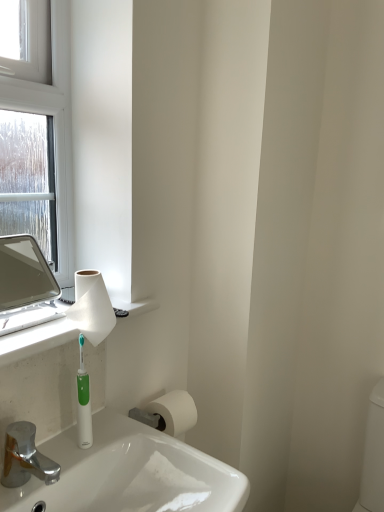
Question: Considering the relative positions of white paper towel at upper left, which appears as the second toilet paper when viewed from the right, and matte silver mirror at left in the image provided, is white paper towel at upper left, which appears as the second toilet paper when viewed from the right, to the left or to the right of matte silver mirror at left?

Choices:
 (A) right
 (B) left

Answer: (A)

Question: Looking at their shapes, would you say white paper towel at upper left, which ranks as the first toilet paper in front-to-back order, is wider or thinner than matte silver mirror at left?

Choices:
 (A) wide
 (B) thin

Answer: (B)

Question: Which object is positioned closest to the white paper towel at upper left, which appears as the 2th toilet paper when viewed from the back?

Choices:
 (A) chrome metallic faucet at lower left
 (B) white matte countertop at left
 (C) matte silver mirror at left
 (D) green plastic toothbrush at lower left
 (E) white matte toilet paper at lower center, positioned as the first toilet paper in bottom-to-top order

Answer: (B)

Question: Which of these objects is positioned farthest from the chrome metallic faucet at lower left?

Choices:
 (A) green plastic toothbrush at lower left
 (B) white matte toilet paper at lower center, positioned as the first toilet paper in bottom-to-top order
 (C) white paper towel at upper left, which ranks as the first toilet paper in front-to-back order
 (D) white matte countertop at left
 (E) matte silver mirror at left

Answer: (E)